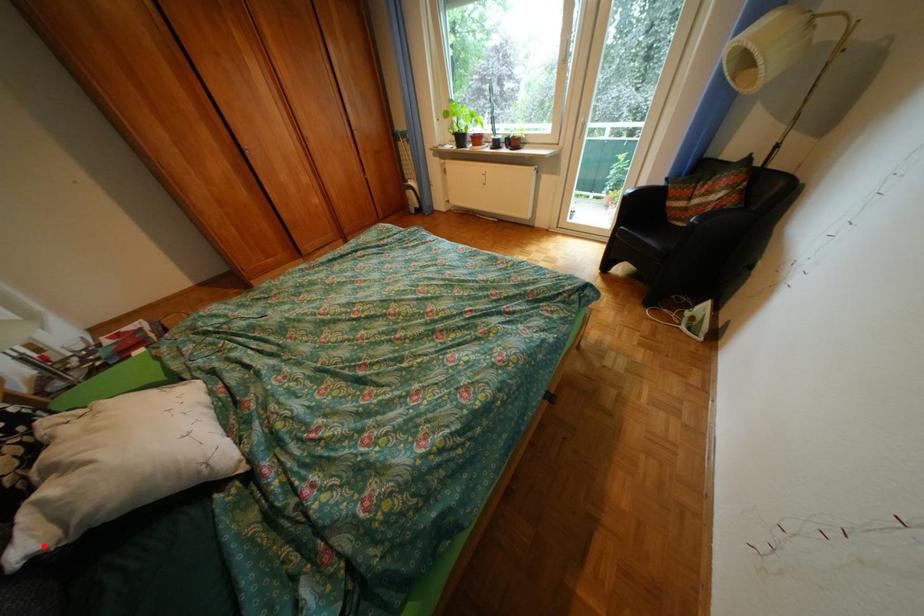
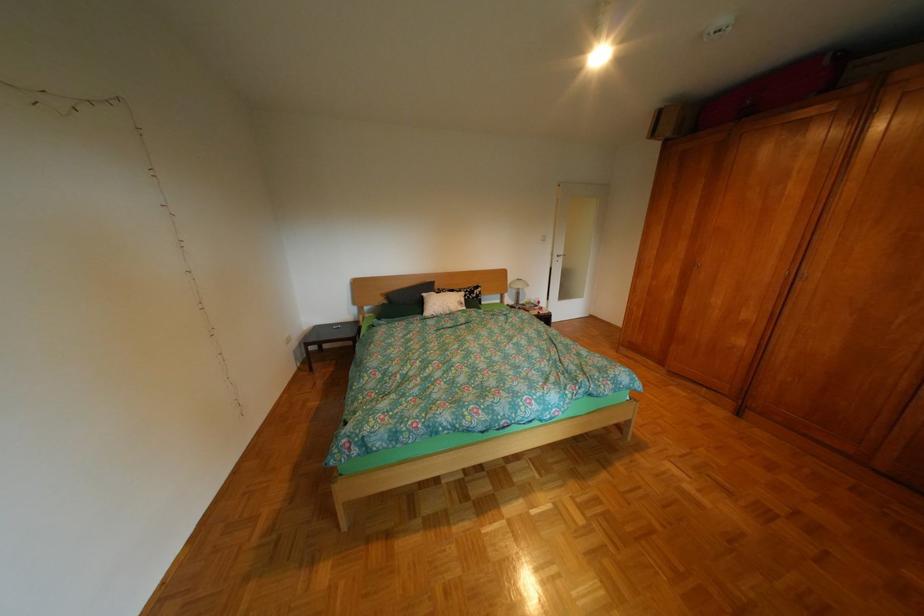
Question: A red point is marked in image1. In image2, is the corresponding 3D point closer to the camera or farther? Reply with the corresponding letter.

Choices:
 (A) The corresponding 3D point is closer.
 (B) The corresponding 3D point is farther.

Answer: (A)